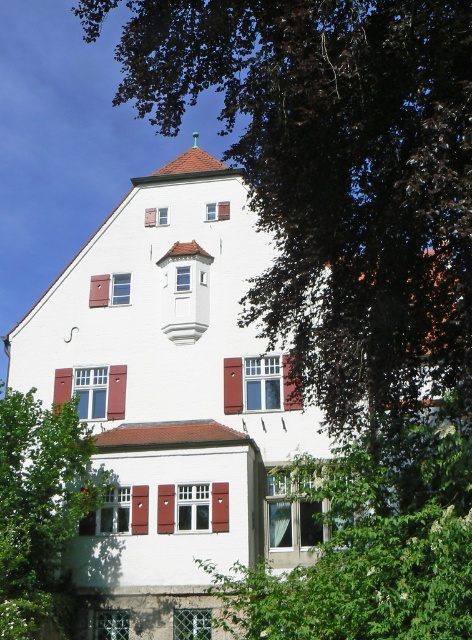
Does green leafy tree at lower left appear under matte wood shutter at center?

Yes, green leafy tree at lower left is below matte wood shutter at center.

Between green leafy tree at lower left and matte wood shutter at center, which one appears on the left side from the viewer's perspective?

green leafy tree at lower left is more to the left.

Is point (78, 502) behind point (118, 282)?

That is False.

I want to click on green leafy tree at lower left, so click(41, 509).

Between red wood shutter at lower center and matte wood shutter at center, which one has more height?

With more height is red wood shutter at lower center.

The height and width of the screenshot is (640, 472). In order to click on red wood shutter at lower center in this screenshot , I will do `click(115, 509)`.

Which of these two, green leafy tree at center or matte wood shutter at center, stands shorter?

matte wood shutter at center is shorter.

The image size is (472, 640). What are the coordinates of `green leafy tree at center` in the screenshot? It's located at (337, 177).